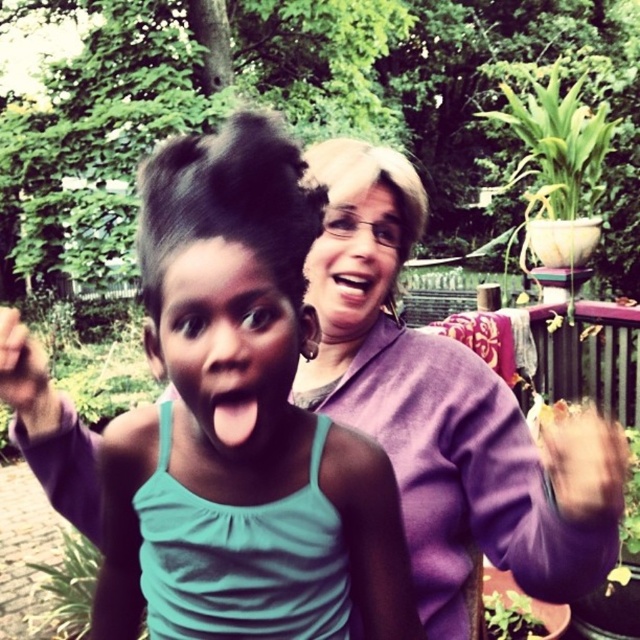
Who is positioned more to the right, pink flesh at center or smooth glossy mouth at center?

Positioned to the right is smooth glossy mouth at center.

Does pink flesh at center appear on the right side of smooth glossy mouth at center?

No, pink flesh at center is not to the right of smooth glossy mouth at center.

This screenshot has height=640, width=640. What are the coordinates of `pink flesh at center` in the screenshot? It's located at click(234, 417).

Find the location of a particular element. Image resolution: width=640 pixels, height=640 pixels. pink flesh at center is located at coordinates (234, 417).

Describe the element at coordinates (24, 372) in the screenshot. I see `matte black hand at upper left` at that location.

Between matte black hand at upper left and pink flesh at center, which one has more height?

Standing taller between the two is matte black hand at upper left.

Is point (28, 394) positioned in front of point (240, 401)?

No, it is not.

The height and width of the screenshot is (640, 640). What are the coordinates of `matte black hand at upper left` in the screenshot? It's located at (24, 372).

Between point (70, 614) and point (326, 291), which one is positioned in front?

Point (326, 291)

Is point (29, 564) behind point (358, 289)?

Yes, point (29, 564) is behind point (358, 289).

Is point (54, 595) positioned behind point (332, 284)?

Yes, it is.

This screenshot has width=640, height=640. I want to click on green leafy plant at lower left, so click(x=68, y=588).